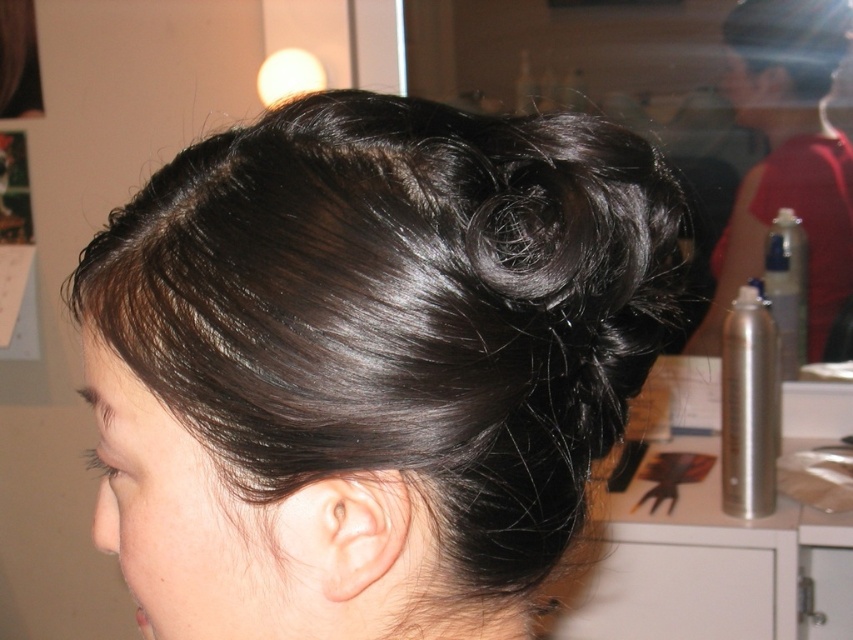
You are a hairstylist examining a client with both a shiny dark hair bun at upper center and a shiny dark brown hair at upper center. Which of these two hair sections is positioned higher on the head?

The shiny dark hair bun at upper center is taller than the shiny dark brown hair at upper center, so it is positioned higher on the head.

You are a hairstylist trying to choose between the shiny dark hair bun at upper center and the silver metallic spray can at right for a client who prefers items with greater thickness. Which object should you select?

The silver metallic spray can at right is thicker than the shiny dark hair bun at upper center, so you should select the silver metallic spray can at right.